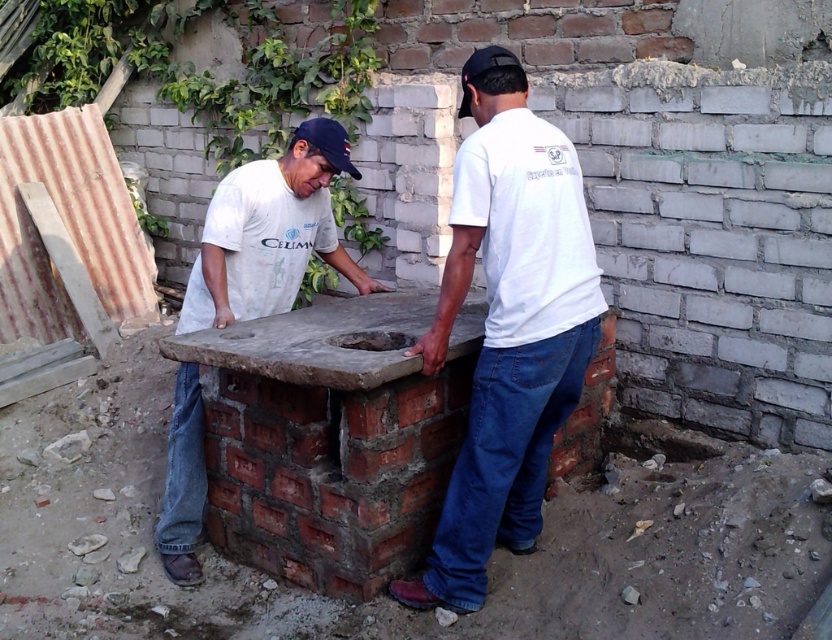
Between white cotton shirt at center and matte concrete oven at center, which one has more height?

white cotton shirt at center

Which is in front, point (493, 129) or point (179, 445)?

Point (493, 129) is in front.

Where is `white cotton shirt at center`? white cotton shirt at center is located at coordinates (508, 326).

Is point (587, 321) more distant than point (350, 161)?

No.

Can you confirm if white cotton shirt at center is positioned to the left of black fabric baseball cap at upper center?

In fact, white cotton shirt at center is to the right of black fabric baseball cap at upper center.

Where is `white cotton shirt at center`? The image size is (832, 640). white cotton shirt at center is located at coordinates (508, 326).

Locate an element on the screen. white cotton shirt at center is located at coordinates (508, 326).

Is matte concrete oven at center positioned in front of black fabric baseball cap at upper center?

That is True.

Which is in front, point (238, 237) or point (328, 120)?

Point (238, 237)

Where is `matte concrete oven at center`? Image resolution: width=832 pixels, height=640 pixels. matte concrete oven at center is located at coordinates (265, 241).